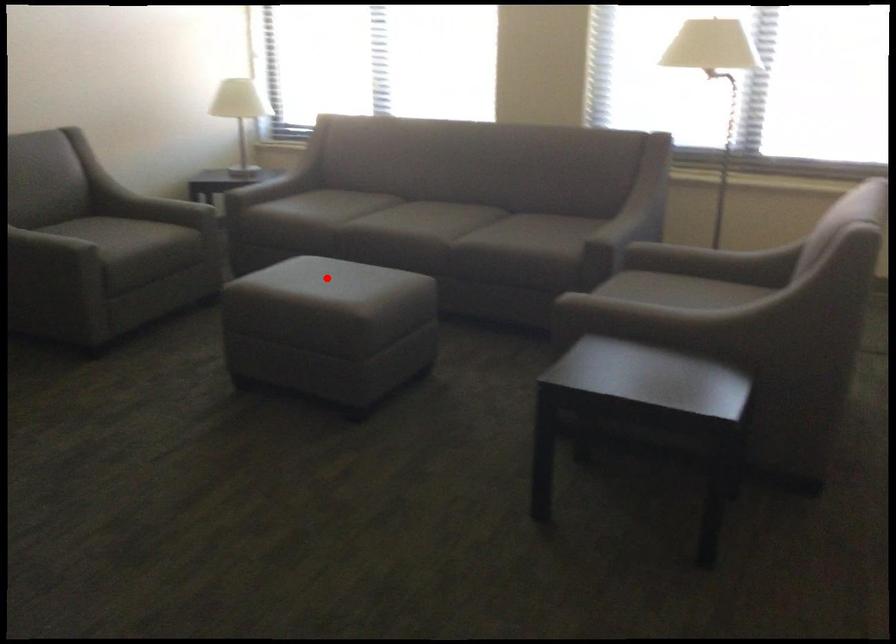
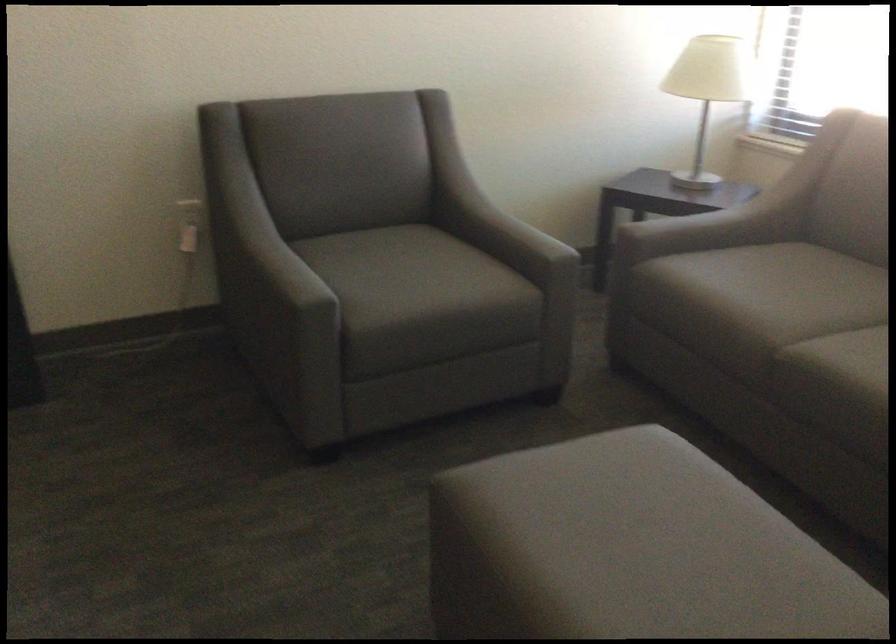
Locate, in the second image, the point that corresponds to the highlighted location in the first image.

(633, 542)